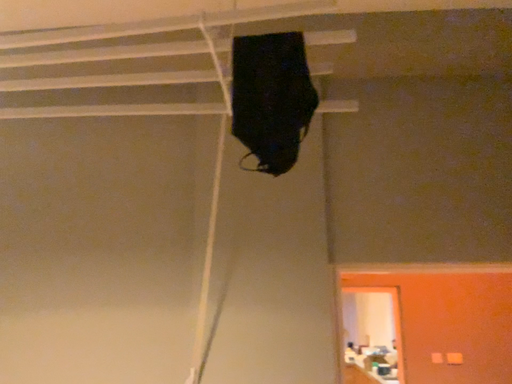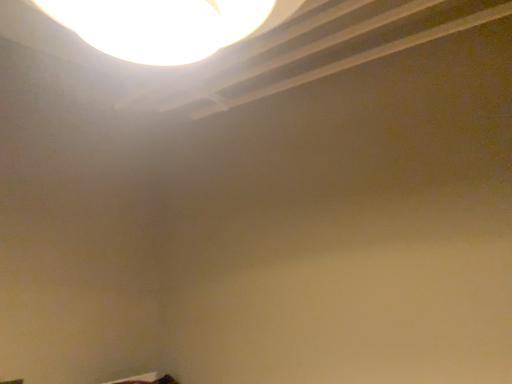
Question: How did the camera likely rotate when shooting the video?

Choices:
 (A) rotated left
 (B) rotated right

Answer: (A)